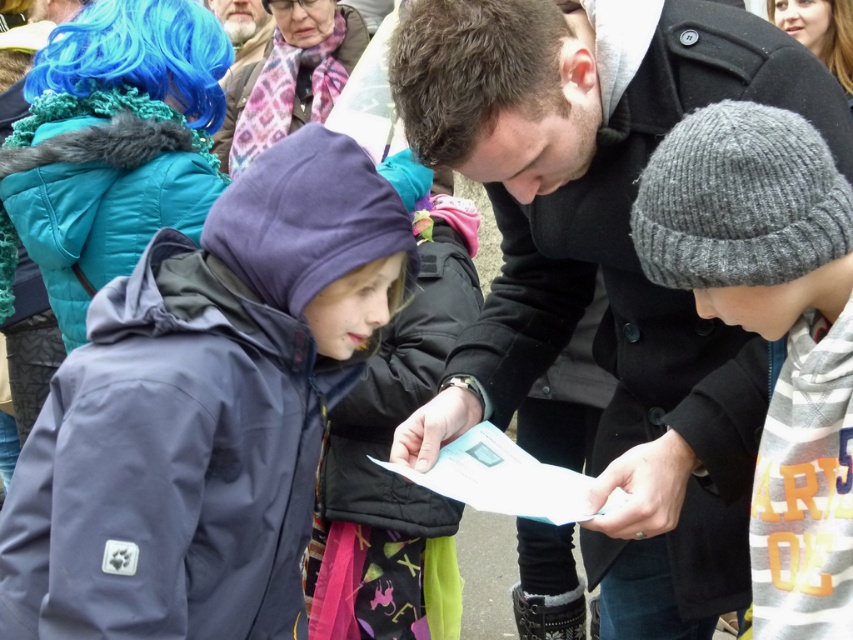
Question: Can you confirm if black wool coat at center is thinner than matte black coat at upper center?

Choices:
 (A) no
 (B) yes

Answer: (A)

Question: Which point is closer to the camera?

Choices:
 (A) blue synthetic wig at upper left
 (B) black wool coat at center
 (C) matte black coat at upper center
 (D) gray knitted beanie at center

Answer: (D)

Question: Which of the following is the farthest from the observer?

Choices:
 (A) (844, 58)
 (B) (424, 104)

Answer: (A)

Question: Is the position of gray knitted beanie at center more distant than that of blue synthetic wig at upper right?

Choices:
 (A) no
 (B) yes

Answer: (A)

Question: Which point is farther to the camera?

Choices:
 (A) (427, 4)
 (B) (263, 136)

Answer: (B)

Question: Does black wool coat at center have a lesser width compared to blue synthetic wig at upper left?

Choices:
 (A) no
 (B) yes

Answer: (A)